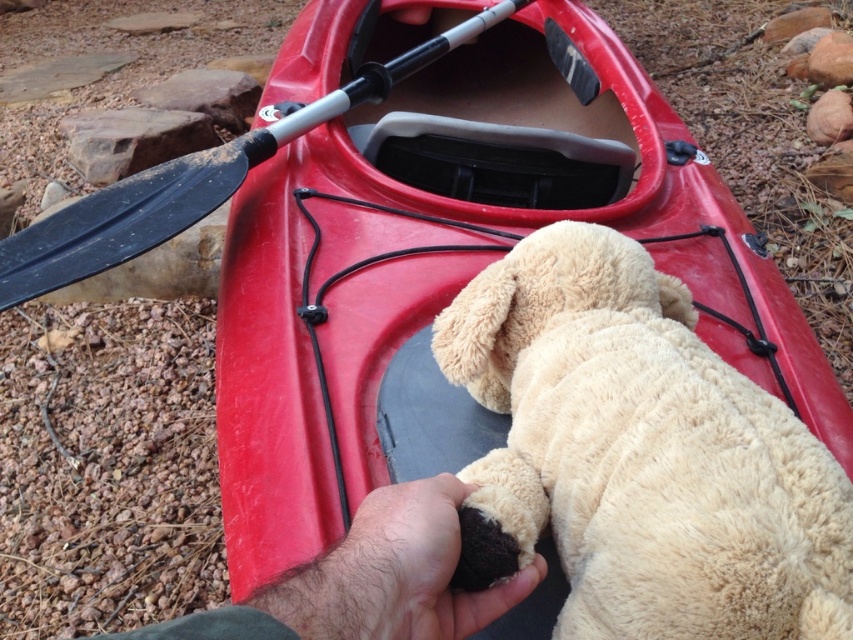
Is beige plush toy at center shorter than hairy hand at lower center?

No, beige plush toy at center is not shorter than hairy hand at lower center.

Is point (619, 362) farther from camera compared to point (251, 618)?

Yes, it is.

This screenshot has width=853, height=640. I want to click on beige plush toy at center, so click(x=637, y=456).

Does rubber kayak at center appear under black rubber paddle at upper left?

Yes.

The image size is (853, 640). What are the coordinates of `rubber kayak at center` in the screenshot? It's located at (451, 276).

Is point (438, 500) closer to camera compared to point (155, 189)?

Yes, point (438, 500) is closer to viewer.

Can you confirm if hairy hand at lower center is positioned above black rubber paddle at upper left?

Incorrect, hairy hand at lower center is not positioned above black rubber paddle at upper left.

Does point (253, 604) come behind point (363, 83)?

That is False.

At what (x,y) coordinates should I click in order to perform the action: click on hairy hand at lower center. Please return your answer as a coordinate pair (x, y). Looking at the image, I should click on (369, 580).